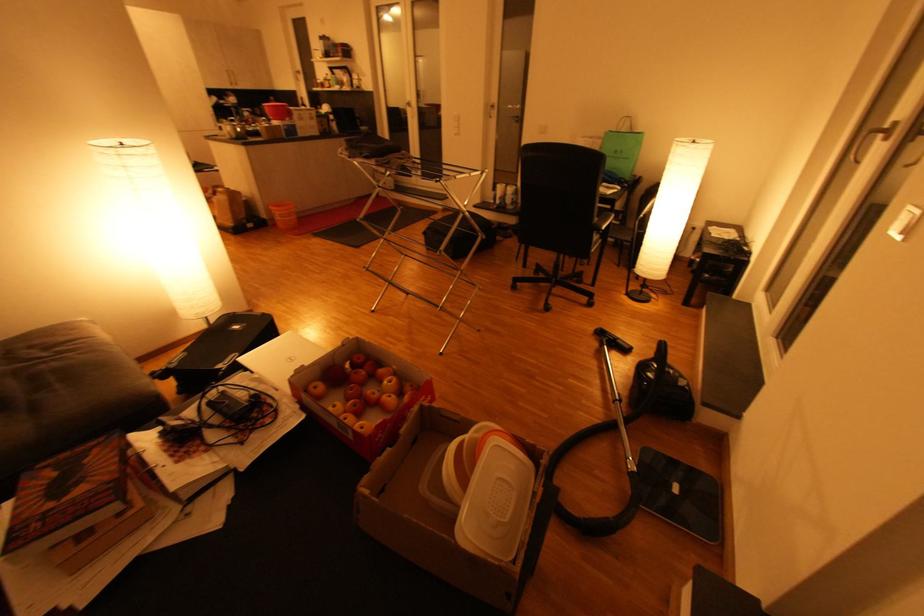
You are a GUI agent. You are given a task and a screenshot of the screen. Output one action in this format:
    pyautogui.click(x=<x>, y=<y>)
    Task: Click on the black vacuum cleaner
    This screenshot has width=924, height=616.
    Given the screenshot: What is the action you would take?
    pyautogui.click(x=649, y=459)